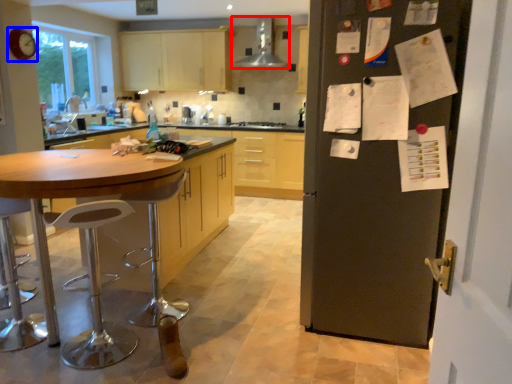
Question: Which point is closer to the camera, kitchen appliance (highlighted by a red box) or clock (highlighted by a blue box)?

Choices:
 (A) kitchen appliance
 (B) clock

Answer: (B)